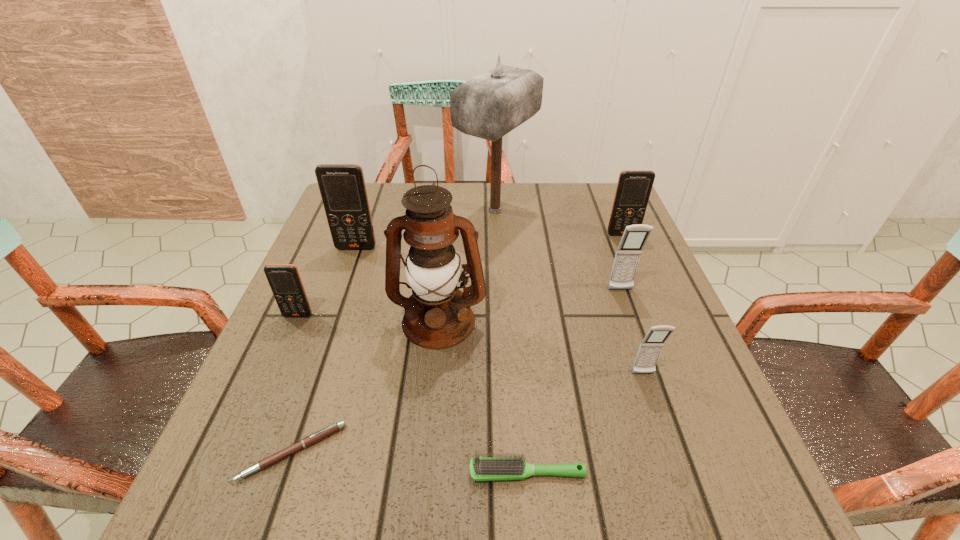
Where is `orange cellular telephone that is the second nearest to the third nearest object`? The height and width of the screenshot is (540, 960). orange cellular telephone that is the second nearest to the third nearest object is located at coordinates (284, 279).

The image size is (960, 540). What are the coordinates of `free point that satisfies the following two spatial constraints: 1. at the nib of the shortest object; 2. on the left side of the light hairbrush` in the screenshot? It's located at (285, 472).